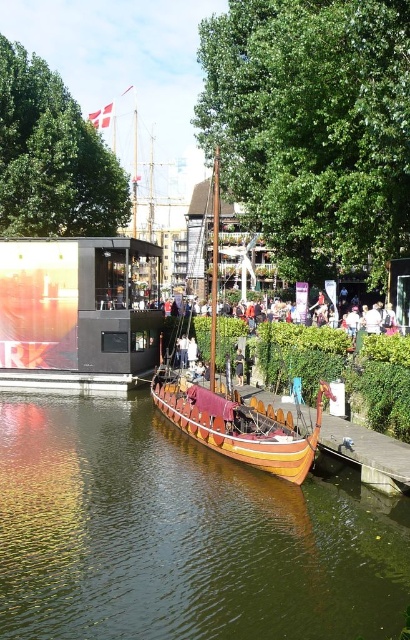
Question: Which point is farther to the camera?

Choices:
 (A) brown wooden boat at center
 (B) wooden polished boat at center

Answer: (B)

Question: Is brown wooden boat at center above wooden polished boat at center?

Choices:
 (A) yes
 (B) no

Answer: (B)

Question: From the image, what is the correct spatial relationship of brown wooden boat at center in relation to wooden polished boat at center?

Choices:
 (A) left
 (B) right

Answer: (A)

Question: Which point is closer to the camera?

Choices:
 (A) (134, 564)
 (B) (193, 390)

Answer: (A)

Question: Which object appears closest to the camera in this image?

Choices:
 (A) wooden polished boat at center
 (B) brown wooden boat at center

Answer: (B)

Question: Considering the relative positions of brown wooden boat at center and wooden polished boat at center in the image provided, where is brown wooden boat at center located with respect to wooden polished boat at center?

Choices:
 (A) left
 (B) right

Answer: (A)